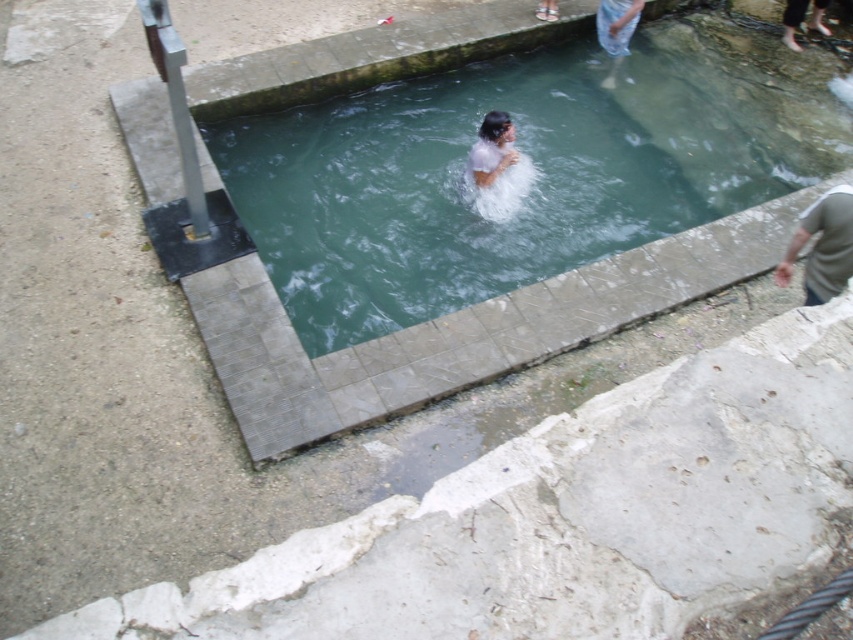
Question: Which point is farther from the camera taking this photo?

Choices:
 (A) [x=506, y=147]
 (B) [x=780, y=284]
 (C) [x=218, y=148]
 (D) [x=625, y=6]

Answer: (D)

Question: Can you confirm if green concrete pool at center is positioned below blue denim jeans at upper right?

Choices:
 (A) yes
 (B) no

Answer: (A)

Question: Among these points, which one is farthest from the camera?

Choices:
 (A) (436, 205)
 (B) (842, 202)

Answer: (A)

Question: Is green concrete pool at center thinner than blue denim jeans at upper right?

Choices:
 (A) no
 (B) yes

Answer: (A)

Question: Which of the following is the farthest from the observer?

Choices:
 (A) (503, 147)
 (B) (788, 252)
 (C) (387, 88)

Answer: (C)

Question: Is green concrete pool at center below gray cotton shirt at lower right?

Choices:
 (A) no
 (B) yes

Answer: (A)